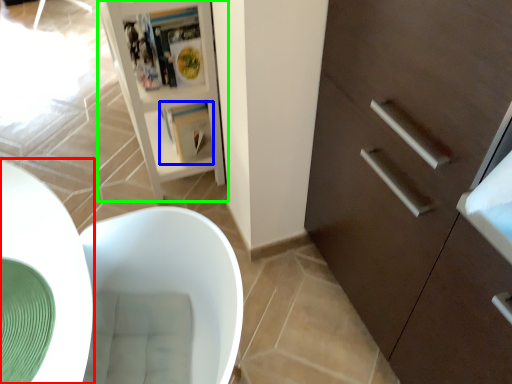
Question: Which object is the closest to the round table (highlighted by a red box)? Choose among these: magazine (highlighted by a blue box) or cupboard (highlighted by a green box).

Choices:
 (A) magazine
 (B) cupboard

Answer: (B)